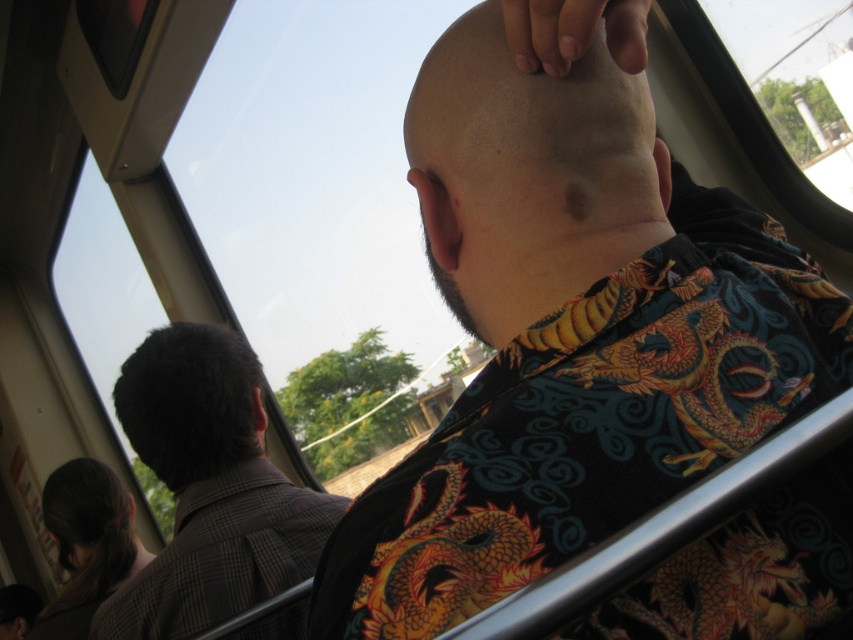
You are a photographer trying to capture a closeup of the smooth bald head at upper center and the dark brown hair at left in the train scene. Since you want both subjects in focus, which one should you adjust your camera focus on first considering their sizes?

The smooth bald head at upper center has a smaller size compared to dark brown hair at left, so you should focus on the smooth bald head at upper center first to ensure it is in focus before adjusting for the larger dark brown hair at left.

You are a photographer on a train trying to capture a candid shot. You notice the smooth bald head at upper center and the dark brown hair at left. Which of these two subjects is positioned to the right side from your viewpoint?

The smooth bald head at upper center is positioned to the right of the dark brown hair at left, so the smooth bald head at upper center is on the right side from your viewpoint.

You are a delivery robot in a train car. You need to place a small package between the brown checkered coat at left and the brown hair at lower left. The package is 50 centimeters long. Can you fit the package in the space between them?

The distance between the brown checkered coat at left and the brown hair at lower left is 67.59 centimeters. Since the package is 50 centimeters long, it can fit in the space between them as there is enough room.